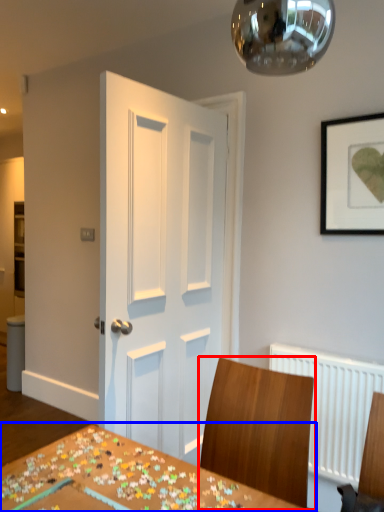
Question: Which point is further to the camera, chair (highlighted by a red box) or table (highlighted by a blue box)?

Choices:
 (A) chair
 (B) table

Answer: (A)